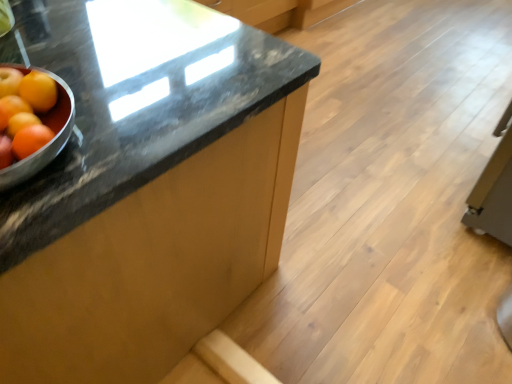
Where is `unoccupied region to the right of orange matte at left`? unoccupied region to the right of orange matte at left is located at coordinates [134, 108].